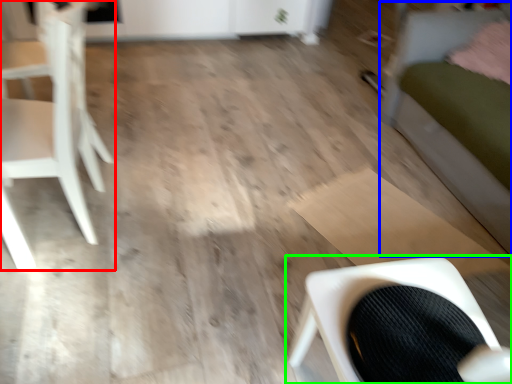
Question: Considering the real-world distances, which object is farthest from chair (highlighted by a red box)? bed (highlighted by a blue box) or chair (highlighted by a green box)?

Choices:
 (A) bed
 (B) chair

Answer: (A)